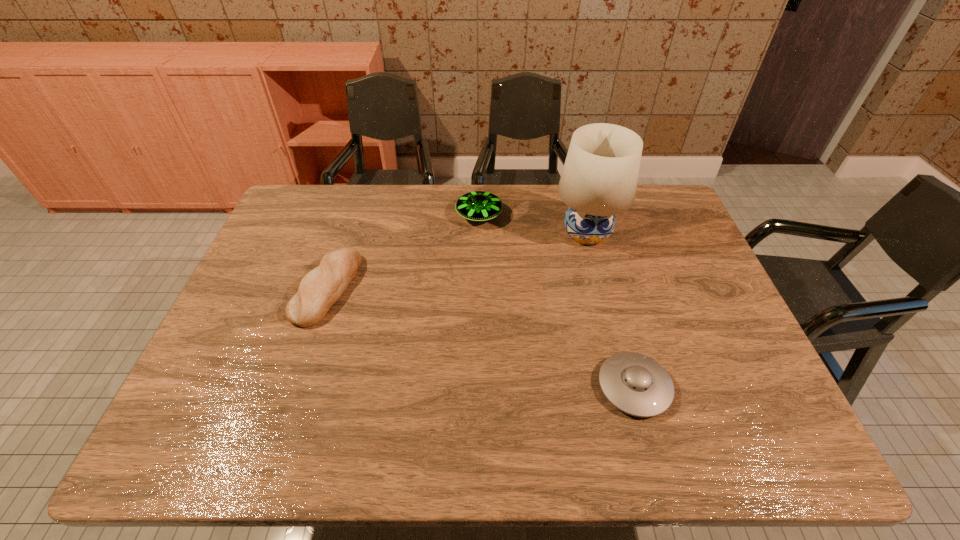
Identify the location of free area in between the second shortest object and the lampshade. (457, 261).

Image resolution: width=960 pixels, height=540 pixels. I want to click on vacant area that lies between the nearest object and the third tallest object, so click(481, 338).

The image size is (960, 540). Find the location of `free space between the lampshade and the second object from left to right`. free space between the lampshade and the second object from left to right is located at coordinates (533, 225).

Where is `vacant space that's between the second shortest object and the lampshade`? Image resolution: width=960 pixels, height=540 pixels. vacant space that's between the second shortest object and the lampshade is located at coordinates 457,261.

At what (x,y) coordinates should I click in order to perform the action: click on empty location between the bread and the shortest object. Please return your answer as a coordinate pair (x, y). Looking at the image, I should click on (481, 338).

In order to click on free point between the left saucer and the right saucer in this screenshot , I will do `click(557, 301)`.

This screenshot has height=540, width=960. In order to click on vacant point located between the tallest object and the taller saucer in this screenshot , I will do `click(533, 225)`.

This screenshot has width=960, height=540. What are the coordinates of `free point between the second shortest object and the shortest object` in the screenshot? It's located at 481,338.

I want to click on vacant space that is in between the second object from left to right and the lampshade, so click(x=533, y=225).

At what (x,y) coordinates should I click in order to perform the action: click on object that is the second closest to the tallest object. Please return your answer as a coordinate pair (x, y). Looking at the image, I should click on (636, 384).